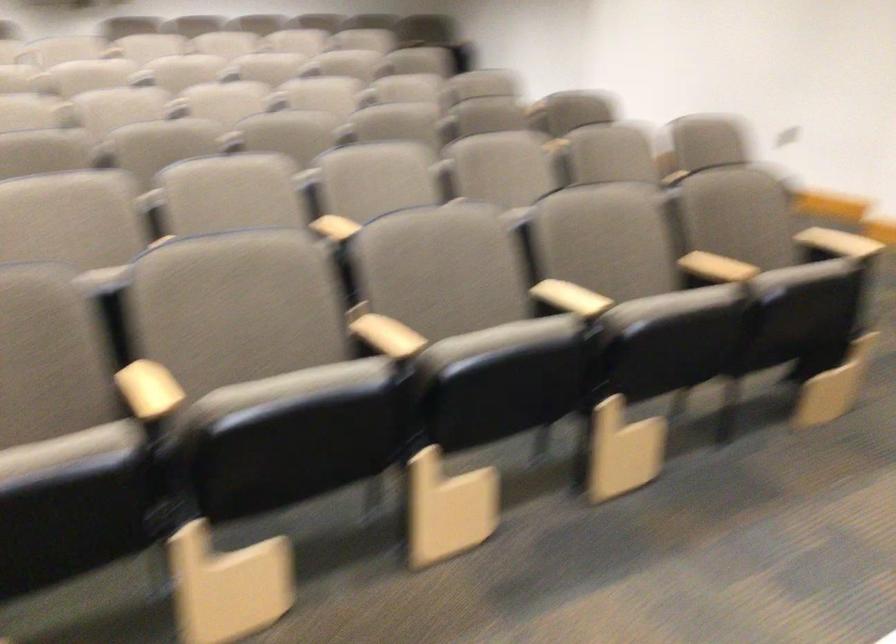
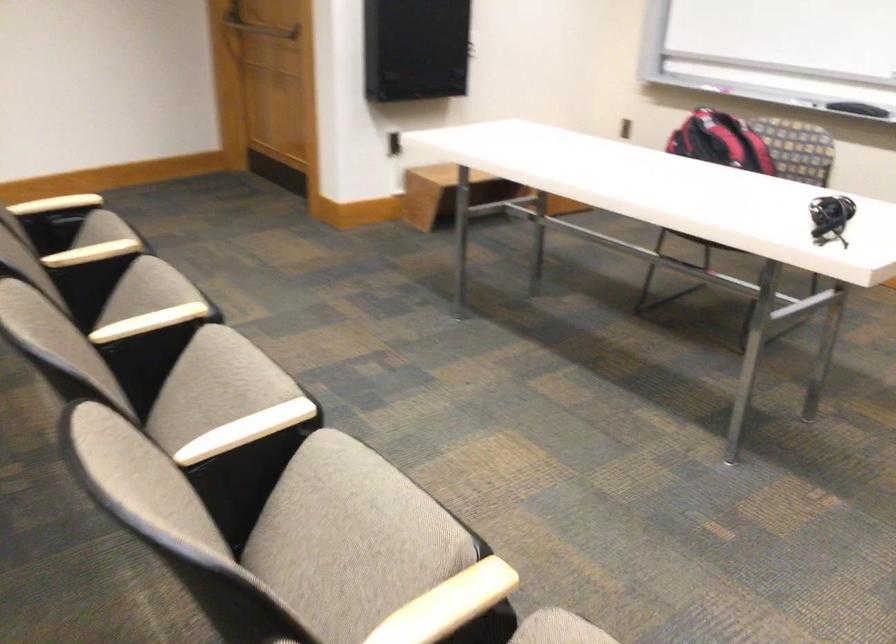
The point at (822, 239) is marked in the first image. Where is the corresponding point in the second image?

(56, 204)